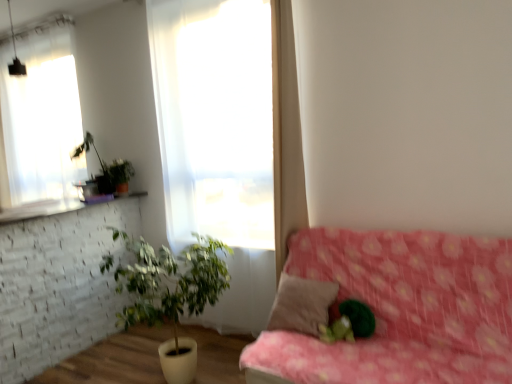
Question: Looking at their shapes, would you say green leafy plant in white pot at lower left, which is the 1th houseplant from front to back, is wider or thinner than green fuzzy ball at center?

Choices:
 (A) thin
 (B) wide

Answer: (B)

Question: Based on their sizes in the image, would you say green leafy plant in white pot at lower left, placed as the first houseplant when sorted from right to left, is bigger or smaller than green fuzzy ball at center?

Choices:
 (A) small
 (B) big

Answer: (B)

Question: Considering the real-world distances, which object is farthest from the translucent fabric at center, the 2th window when ordered from left to right?

Choices:
 (A) green fuzzy ball at center
 (B) white sheer curtain at upper left, the 1th window from the left
 (C) pink floral fabric couch at lower right
 (D) brown fabric pillow at center
 (E) green leafy plant at upper left, the first houseplant positioned from the left

Answer: (B)

Question: Which object is the closest to the green leafy plant in white pot at lower left, placed as the first houseplant when sorted from right to left?

Choices:
 (A) translucent fabric at center, the first window in the right-to-left sequence
 (B) brown fabric pillow at center
 (C) green leafy plant at upper left, the first houseplant positioned from the left
 (D) green fuzzy ball at center
 (E) white sheer curtain at upper left, the first window when ordered from back to front

Answer: (B)